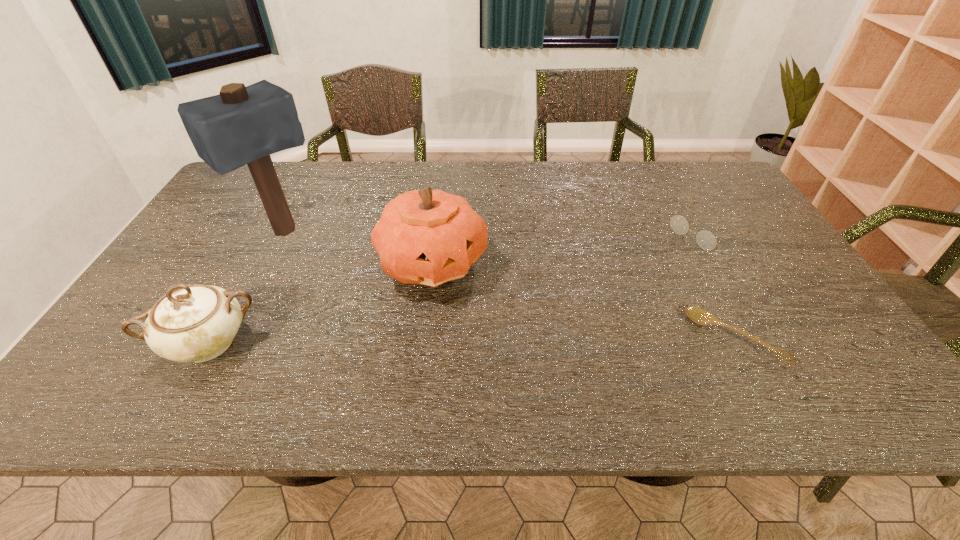
The height and width of the screenshot is (540, 960). Find the location of `free space that is in between the third tallest object and the pumpkin`. free space that is in between the third tallest object and the pumpkin is located at coordinates (322, 303).

Locate an element on the screen. The height and width of the screenshot is (540, 960). free area in between the second tallest object and the tallest object is located at coordinates (359, 247).

Where is `free space between the ladle and the third tallest object`? free space between the ladle and the third tallest object is located at coordinates (472, 341).

The width and height of the screenshot is (960, 540). What are the coordinates of `vacant space that is in between the fourth shortest object and the tallest object` in the screenshot? It's located at (359, 247).

At what (x,y) coordinates should I click in order to perform the action: click on free point between the pumpkin and the mallet. Please return your answer as a coordinate pair (x, y). This screenshot has height=540, width=960. Looking at the image, I should click on (359, 247).

What are the coordinates of `vacant area that lies between the spectacles and the third shortest object` in the screenshot? It's located at (457, 287).

At what (x,y) coordinates should I click in order to perform the action: click on free spot between the second shortest object and the ladle. Please return your answer as a coordinate pair (x, y). Image resolution: width=960 pixels, height=540 pixels. Looking at the image, I should click on click(720, 285).

Identify the location of blank region between the spectacles and the tallest object. (494, 232).

The image size is (960, 540). Identify the location of free spot between the tallest object and the chinaware. (248, 288).

You are a GUI agent. You are given a task and a screenshot of the screen. Output one action in this format:
    pyautogui.click(x=<x>, y=<y>)
    Task: Click on the vacant area between the third tallest object and the third object from right to left
    
    Given the screenshot: What is the action you would take?
    pyautogui.click(x=322, y=303)